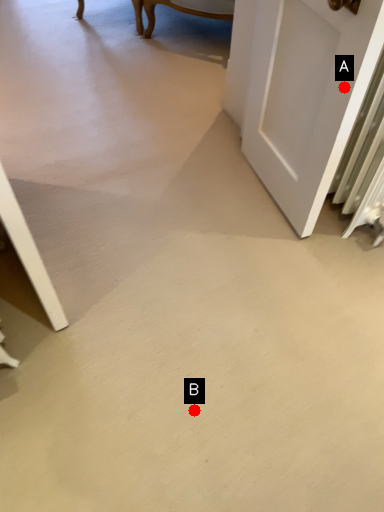
Question: Two points are circled on the image, labeled by A and B beside each circle. Which point is closer to the camera taking this photo?

Choices:
 (A) A is closer
 (B) B is closer

Answer: (A)